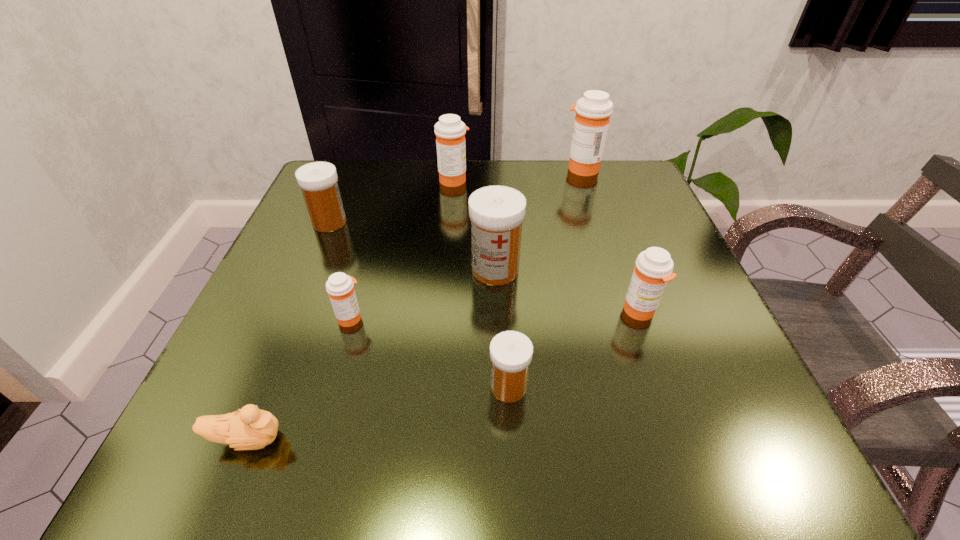
Where is `orange medicine identified as the second closest to the second smallest orange medicine`? The height and width of the screenshot is (540, 960). orange medicine identified as the second closest to the second smallest orange medicine is located at coordinates point(340,287).

Select which white medicine is the second closest to the duckling. Please provide its 2D coordinates. Your answer should be formatted as a tuple, i.e. [(x, y)], where the tuple contains the x and y coordinates of a point satisfying the conditions above.

[(497, 212)]

Image resolution: width=960 pixels, height=540 pixels. In order to click on white medicine that is the third closest to the tallest object in this screenshot , I will do tap(511, 352).

Locate an element on the screen. The width and height of the screenshot is (960, 540). vacant area in the image that satisfies the following two spatial constraints: 1. on the front side of the fifth nearest object; 2. on the right side of the second nearest object is located at coordinates (499, 387).

The height and width of the screenshot is (540, 960). Identify the location of free spot that satisfies the following two spatial constraints: 1. on the front side of the second smallest orange medicine; 2. on the left side of the fifth medicine from right to left. (444, 311).